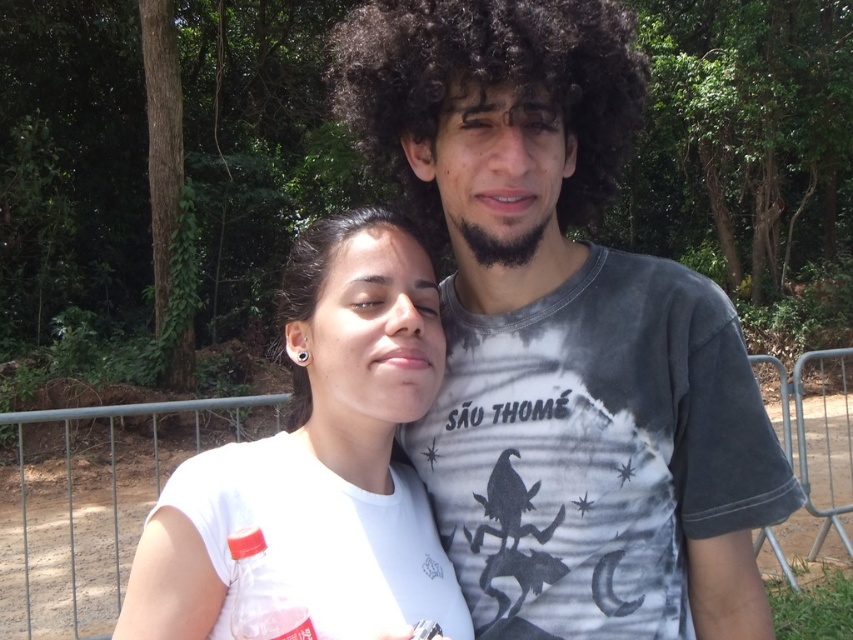
Question: Which object is closer to the camera taking this photo?

Choices:
 (A) black matte afro at center
 (B) metallic gray fence at center

Answer: (A)

Question: Which object appears farthest from the camera in this image?

Choices:
 (A) black matte afro at center
 (B) dark curly hair at center

Answer: (A)

Question: Where is dark gray t-shirt at center located in relation to metallic gray fence at center in the image?

Choices:
 (A) right
 (B) left

Answer: (B)

Question: Observing the image, what is the correct spatial positioning of metallic gray fence at center in reference to dark curly hair at center?

Choices:
 (A) left
 (B) right

Answer: (B)

Question: Is dark gray t-shirt at center smaller than metallic gray fence at center?

Choices:
 (A) no
 (B) yes

Answer: (B)

Question: Which object is positioned closest to the metallic gray fence at center?

Choices:
 (A) black matte afro at center
 (B) dark curly hair at center
 (C) dark gray t-shirt at center

Answer: (A)